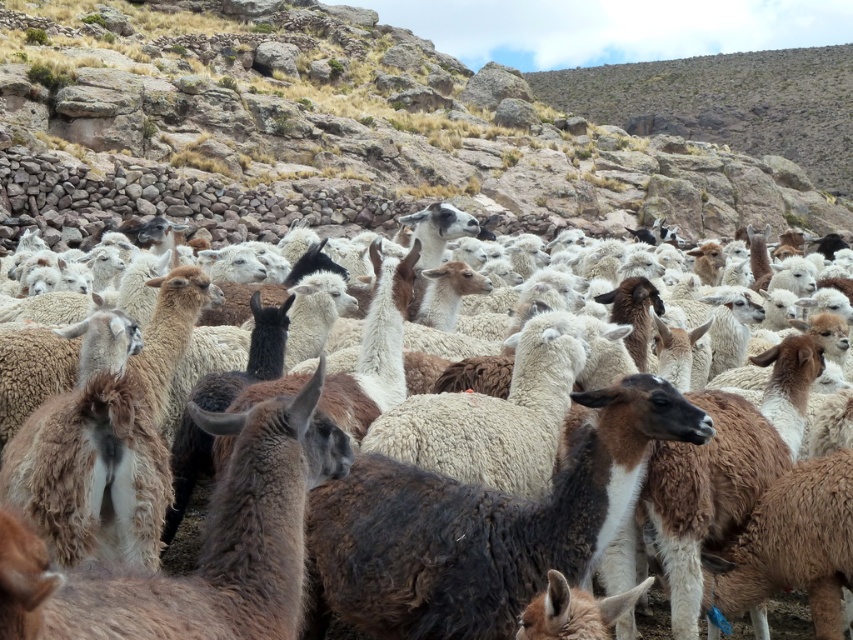
You are a farmer who needs to separate the brown woolen alpacas at center from the fuzzy white sheep at center. Which group requires more space to accommodate their size?

The brown woolen alpacas at center are larger in size compared to the fuzzy white sheep at center, so they require more space to accommodate their size.